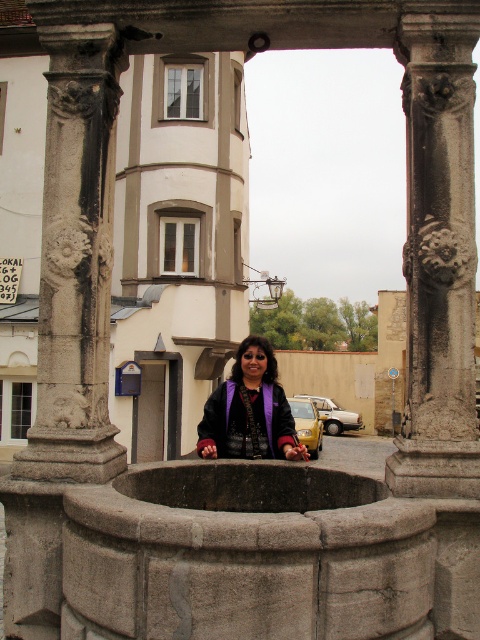
You are standing in front of the ornate stone structure with two columns. You notice a specific point marked at coordinates (439, 259). Which object from the scene is located exactly at that point?

The carved stone column at right is located exactly at point (439, 259).

You are a photographer setting up for a portrait. You notice a purple fabric at center and a yellow matte car at center in the scene. Which object is shorter in height?

The purple fabric at center is not as tall as the yellow matte car at center, so the purple fabric at center is shorter in height.

You are standing in front of the ornate stone structure with two columns. There is a point marked at coordinates (439, 259). What does this point indicate?

The point at (439, 259) indicates the carved stone column at right.